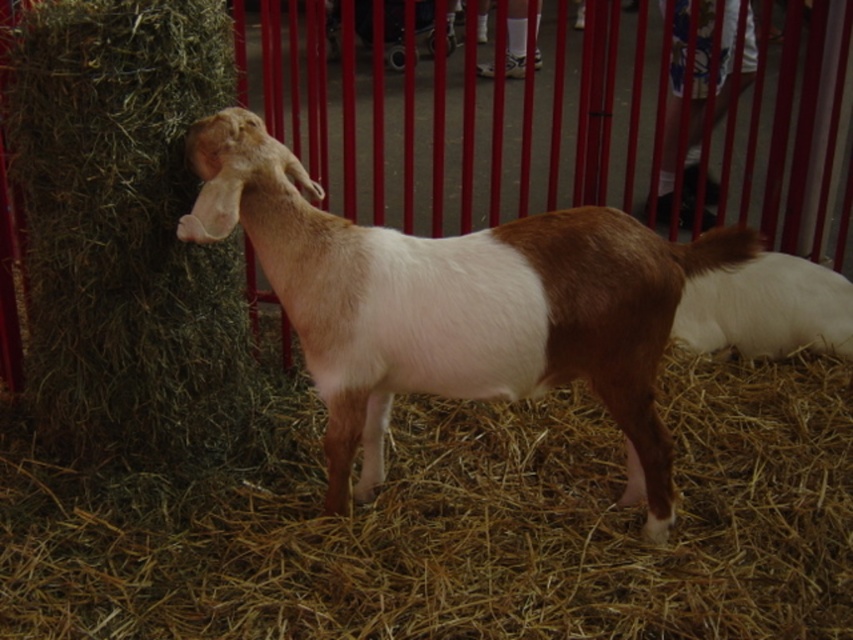
Question: Which point is farther to the camera?

Choices:
 (A) white soft fur goat at right
 (B) brown/white fur goat at center

Answer: (A)

Question: Is brown/white fur goat at center in front of white soft fur goat at right?

Choices:
 (A) no
 (B) yes

Answer: (B)

Question: Among these objects, which one is farthest from the camera?

Choices:
 (A) brown/white fur goat at center
 (B) white soft fur goat at right
 (C) brown straw at center

Answer: (B)

Question: Based on their relative distances, which object is nearer to the brown straw at center?

Choices:
 (A) brown/white fur goat at center
 (B) white soft fur goat at right

Answer: (A)

Question: Is brown straw at center thinner than white soft fur goat at right?

Choices:
 (A) no
 (B) yes

Answer: (A)

Question: Can you confirm if brown straw at center is thinner than white soft fur goat at right?

Choices:
 (A) yes
 (B) no

Answer: (B)